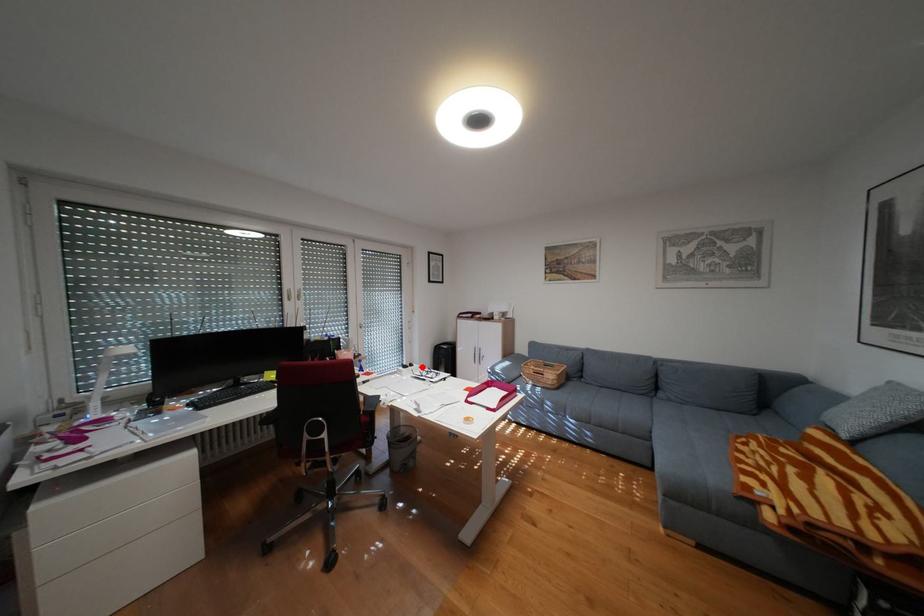
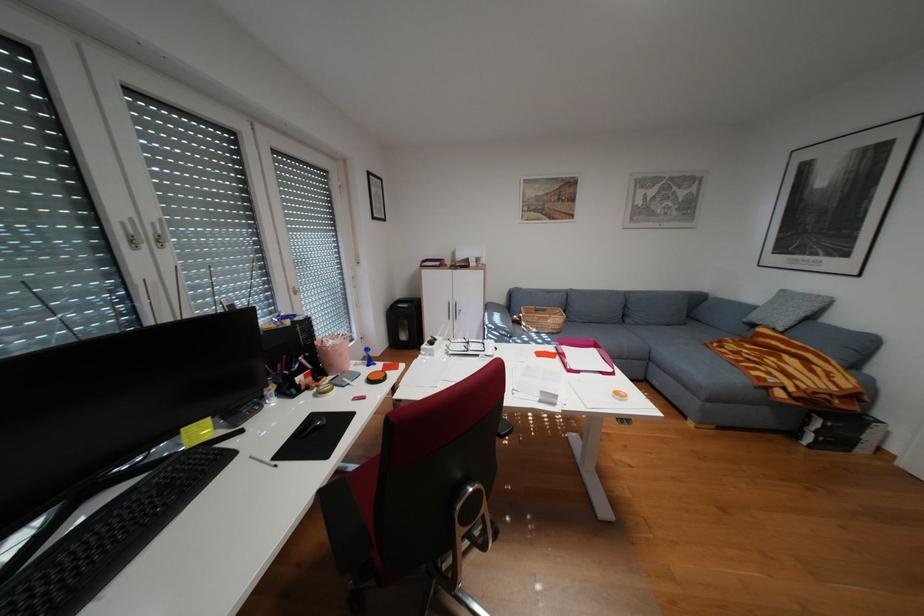
The point at the highlighted location is marked in the first image. Where is the corresponding point in the second image?

(448, 342)